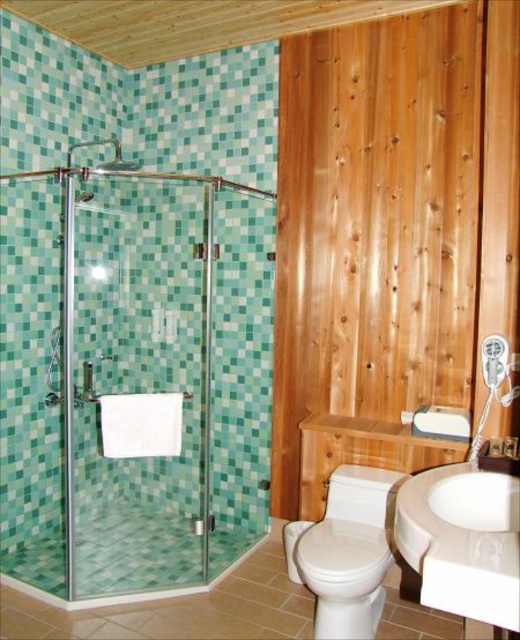
Between white glossy toilet at lower center and clear glass shower door at left, which one has more height?

With more height is clear glass shower door at left.

Measure the distance from white glossy toilet at lower center to clear glass shower door at left.

white glossy toilet at lower center is 78.32 centimeters from clear glass shower door at left.

Which is behind, point (319, 636) or point (205, 198)?

Point (205, 198)

Locate an element on the screen. The image size is (520, 640). white glossy toilet at lower center is located at coordinates (346, 552).

Who is lower down, white glossy sink at lower right or clear glass shower door at left?

white glossy sink at lower right is below.

At what (x,y) coordinates should I click in order to perform the action: click on white glossy sink at lower right. Please return your answer as a coordinate pair (x, y). Looking at the image, I should click on (462, 541).

Between white glossy sink at lower right and white glossy toilet at lower center, which one appears on the left side from the viewer's perspective?

From the viewer's perspective, white glossy toilet at lower center appears more on the left side.

Is white glossy sink at lower right positioned in front of white glossy toilet at lower center?

Yes, white glossy sink at lower right is in front of white glossy toilet at lower center.

Is point (458, 520) in front of point (362, 624)?

Yes.

Image resolution: width=520 pixels, height=640 pixels. Identify the location of white glossy sink at lower right. (462, 541).